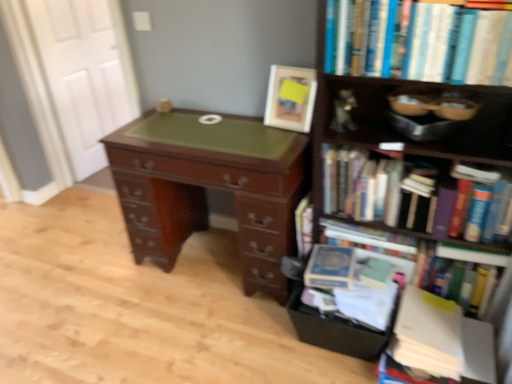
Question: Is white paper stack at lower right, the 5th book when ordered from top to bottom, with white wood door at upper left?

Choices:
 (A) yes
 (B) no

Answer: (B)

Question: From the image's perspective, is white paper stack at lower right, the 5th book when ordered from top to bottom, beneath white wood door at upper left?

Choices:
 (A) yes
 (B) no

Answer: (A)

Question: From the image's perspective, does white paper stack at lower right, the 5th book when ordered from top to bottom, appear higher than white wood door at upper left?

Choices:
 (A) no
 (B) yes

Answer: (A)

Question: Is white paper stack at lower right, which appears as the 1th book when ordered from the bottom, positioned behind white wood door at upper left?

Choices:
 (A) no
 (B) yes

Answer: (A)

Question: Considering the relative sizes of white paper stack at lower right, the 5th book when ordered from top to bottom, and white wood door at upper left in the image provided, is white paper stack at lower right, the 5th book when ordered from top to bottom, taller than white wood door at upper left?

Choices:
 (A) yes
 (B) no

Answer: (B)

Question: Is hardcover books at right, which is the 4th book from bottom to top, spatially inside black cardboard drawer at lower right, or outside of it?

Choices:
 (A) outside
 (B) inside

Answer: (A)

Question: In the image, is hardcover books at right, which is the 4th book from bottom to top, positioned in front of or behind black cardboard drawer at lower right?

Choices:
 (A) behind
 (B) front

Answer: (B)

Question: Is hardcover books at right, the 2th book viewed from the top, taller or shorter than black cardboard drawer at lower right?

Choices:
 (A) short
 (B) tall

Answer: (B)

Question: Is hardcover books at right, the 2th book viewed from the top, wider or thinner than black cardboard drawer at lower right?

Choices:
 (A) thin
 (B) wide

Answer: (B)

Question: Looking at their shapes, would you say hardcover books at upper right, which appears as the 1th book when viewed from the top, is wider or thinner than white wood door at upper left?

Choices:
 (A) thin
 (B) wide

Answer: (B)

Question: From the image's perspective, is hardcover books at upper right, which appears as the 5th book when ordered from the bottom, positioned above or below white wood door at upper left?

Choices:
 (A) above
 (B) below

Answer: (B)

Question: Is point (343, 52) positioned closer to the camera than point (64, 137)?

Choices:
 (A) closer
 (B) farther

Answer: (A)

Question: Is hardcover books at upper right, which appears as the 1th book when viewed from the top, bigger or smaller than white wood door at upper left?

Choices:
 (A) small
 (B) big

Answer: (A)

Question: Is point (332, 337) closer or farther from the camera than point (420, 231)?

Choices:
 (A) farther
 (B) closer

Answer: (A)

Question: From a real-world perspective, relative to hardcover books at right, the 2th book viewed from the top, is black cardboard drawer at lower right vertically above or below?

Choices:
 (A) below
 (B) above

Answer: (A)